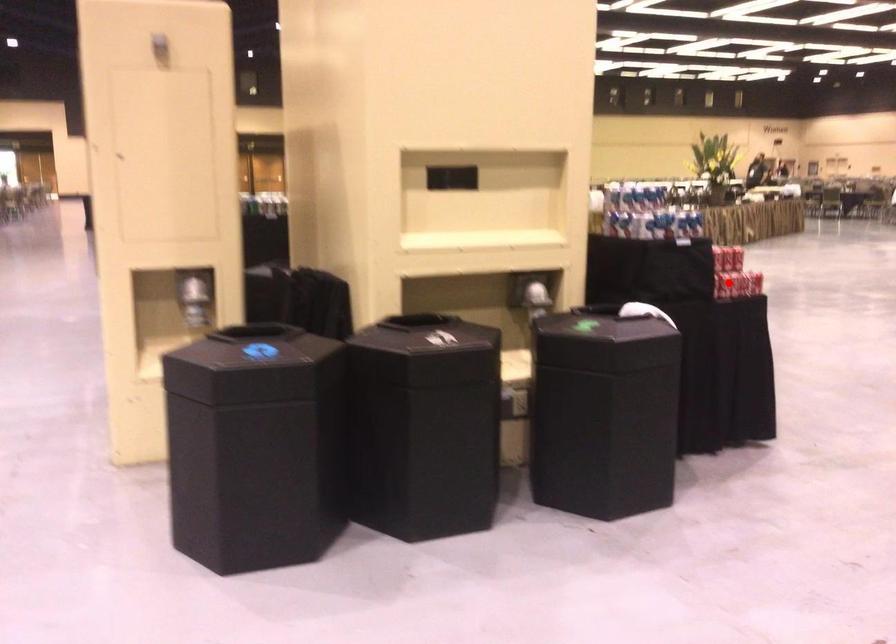
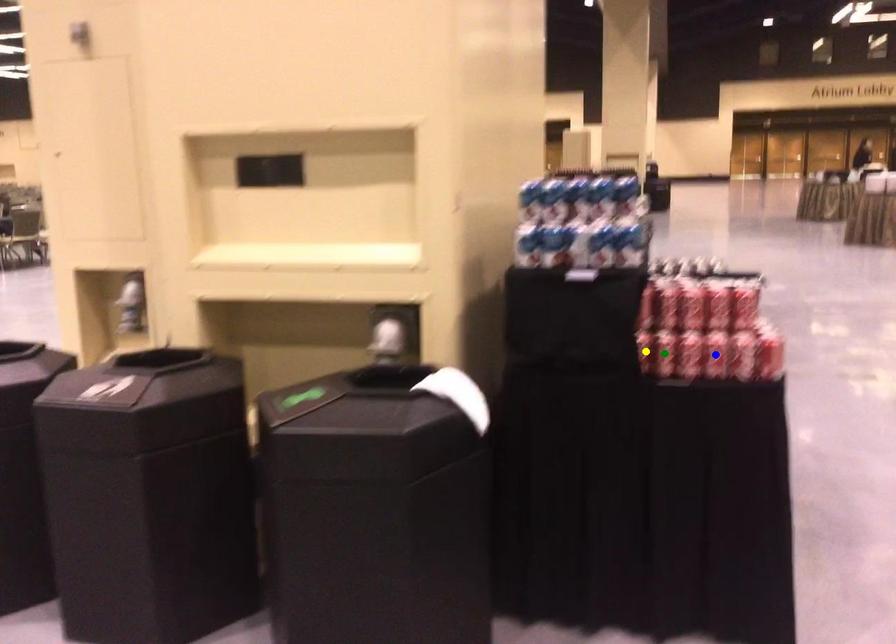
Question: I am providing you with two images of the same scene from different viewpoints. A red point is marked on the first image. You are given multiple points on the second image. Which point in image 2 represents the same 3d spot as the red point in image 1?

Choices:
 (A) blue point
 (B) green point
 (C) yellow point

Answer: (B)